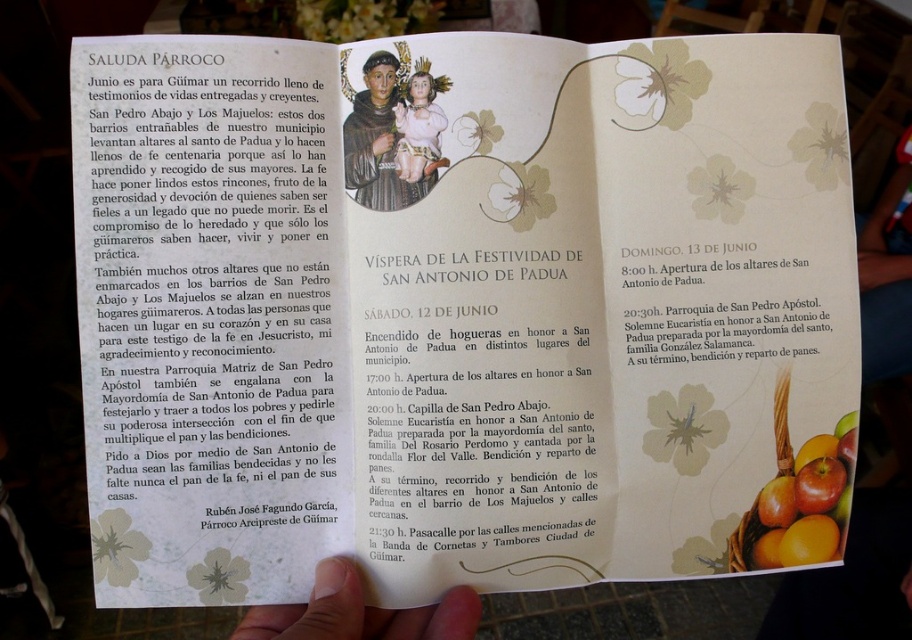
You are a visitor standing 26.05 inches away from the matte black saint at upper center in the image. Can you comfortably read the text on the left page of the booklet without moving closer?

The matte black saint at upper center and viewer are 26.05 inches apart. Since you are standing exactly at that distance, you may be able to comfortably read the text on the left page of the booklet without needing to move closer, assuming standard reading distance requirements are met.

In the scene shown: You are looking at the open booklet and want to place a sticker between the matte black saint at upper center and the shiny red apples at lower right. Which direction should you move from the saint to reach the apples?

You should move to the right from the matte black saint at upper center to reach the shiny red apples at lower right because the saint is to the left of the apples.